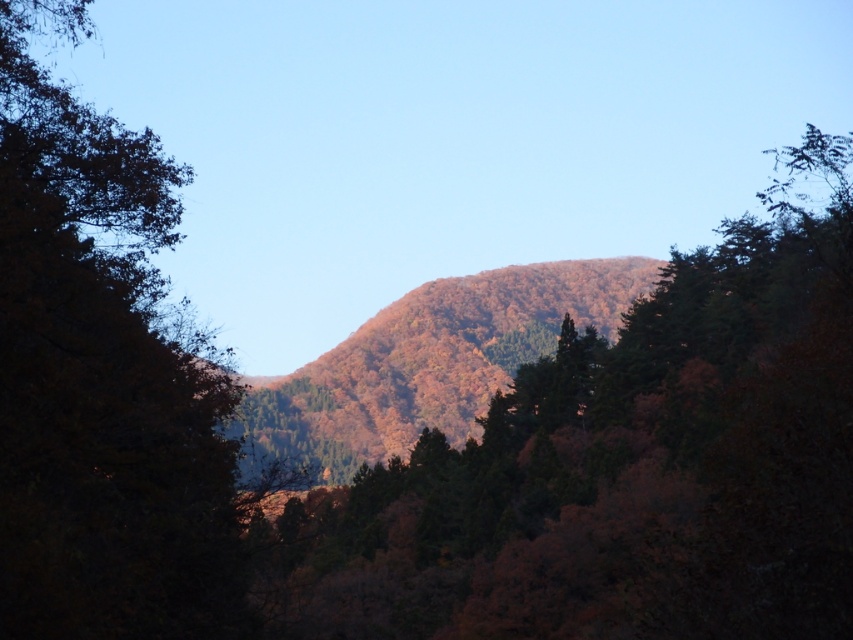
Question: Which of the following is the closest to the observer?

Choices:
 (A) autumn leaves at center
 (B) dark green leafy tree at left
 (C) autumn foliage hill at center

Answer: (B)

Question: Is dark green leafy tree at left in front of autumn foliage hill at center?

Choices:
 (A) yes
 (B) no

Answer: (A)

Question: Which is farther from the autumn leaves at center?

Choices:
 (A) autumn foliage hill at center
 (B) dark green leafy tree at left

Answer: (A)

Question: Can you confirm if autumn leaves at center is thinner than dark green leafy tree at left?

Choices:
 (A) no
 (B) yes

Answer: (A)

Question: Which point is farther to the camera?

Choices:
 (A) (619, 369)
 (B) (73, 580)
 (C) (334, 406)

Answer: (C)

Question: Can you confirm if autumn leaves at center is positioned below dark green leafy tree at left?

Choices:
 (A) no
 (B) yes

Answer: (B)